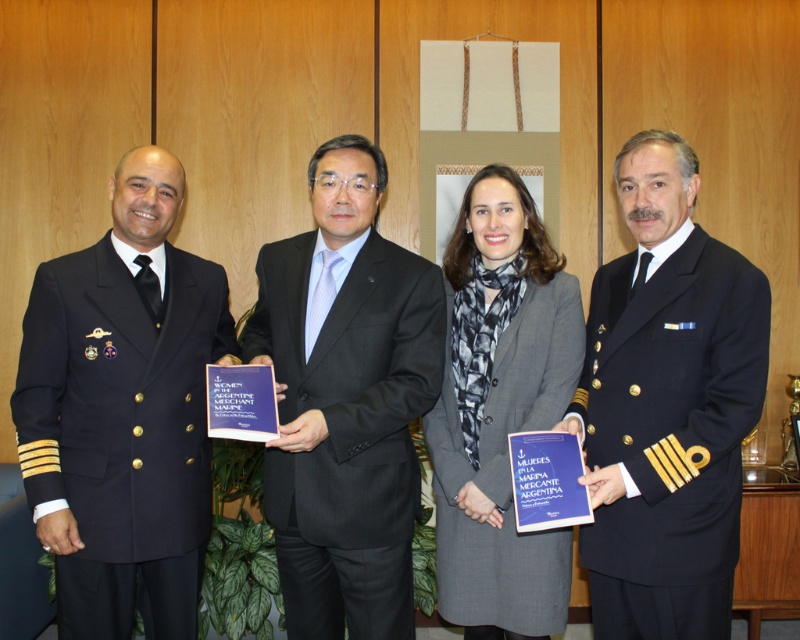
What do you see at coordinates (670, 435) in the screenshot? Image resolution: width=800 pixels, height=640 pixels. I see `navy blue woolen suit at right` at bounding box center [670, 435].

Is point (692, 570) behind point (413, 449)?

No.

Looking at this image, measure the distance between navy blue woolen suit at right and camera.

navy blue woolen suit at right and camera are 1.74 meters apart.

Locate an element on the screen. The width and height of the screenshot is (800, 640). navy blue woolen suit at right is located at coordinates (670, 435).

Is navy blue woolen suit at left taller than gray wool coat at center?

No.

Between point (130, 502) and point (466, 616), which one is positioned behind?

Point (466, 616)

Is point (124, 600) farther from viewer compared to point (476, 536)?

No, (124, 600) is in front of (476, 536).

Where is `navy blue woolen suit at left`? navy blue woolen suit at left is located at coordinates (122, 429).

Does navy blue woolen suit at left have a lesser width compared to black wool suit at center?

Indeed, navy blue woolen suit at left has a lesser width compared to black wool suit at center.

Does navy blue woolen suit at left appear over black wool suit at center?

Incorrect, navy blue woolen suit at left is not positioned above black wool suit at center.

The width and height of the screenshot is (800, 640). Describe the element at coordinates (122, 429) in the screenshot. I see `navy blue woolen suit at left` at that location.

The height and width of the screenshot is (640, 800). What are the coordinates of `navy blue woolen suit at left` in the screenshot? It's located at (122, 429).